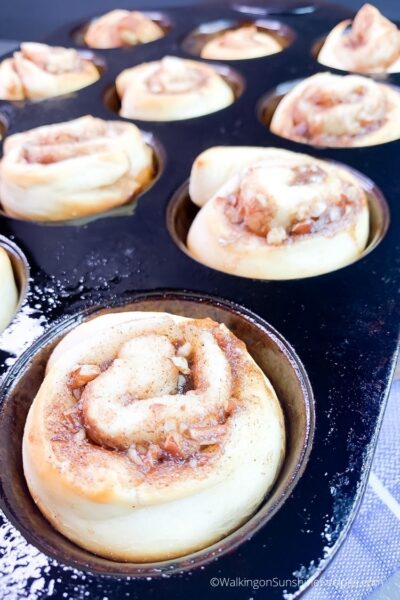
What are the coordinates of `muffin tray` in the screenshot? It's located at (122, 272).